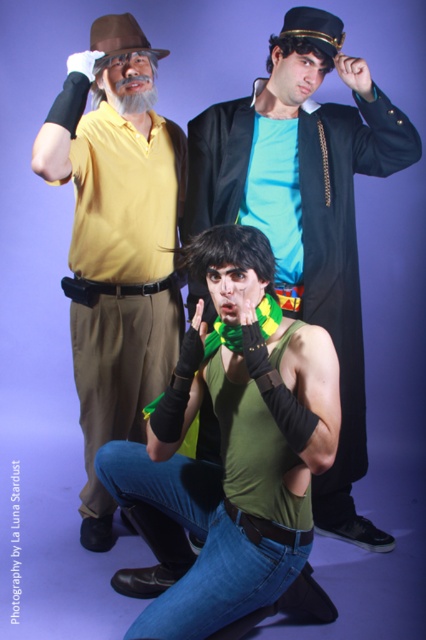
Is point (321, 492) positioned behind point (42, 156)?

Yes, point (321, 492) is behind point (42, 156).

Between green matte tank top at center and matte yellow shirt at upper left, which one has less height?

With less height is matte yellow shirt at upper left.

Which is in front, point (348, 476) or point (157, 138)?

Point (157, 138)

The height and width of the screenshot is (640, 426). Identify the location of green matte tank top at center. (307, 211).

Who is positioned more to the right, green matte vest at center or matte yellow shirt at upper left?

green matte vest at center

Is green matte vest at center shorter than matte yellow shirt at upper left?

Yes, green matte vest at center is shorter than matte yellow shirt at upper left.

Who is more distant from viewer, (267, 264) or (149, 253)?

The point (149, 253) is more distant.

Where is `green matte vest at center`? green matte vest at center is located at coordinates (230, 451).

Does green matte vest at center have a smaller size compared to green matte tank top at center?

Indeed, green matte vest at center has a smaller size compared to green matte tank top at center.

Measure the distance between green matte vest at center and camera.

green matte vest at center is 4.65 feet away from camera.

Who is more distant from viewer, (181, 436) or (342, 465)?

Point (342, 465)

Find the location of a particular element. green matte vest at center is located at coordinates (230, 451).